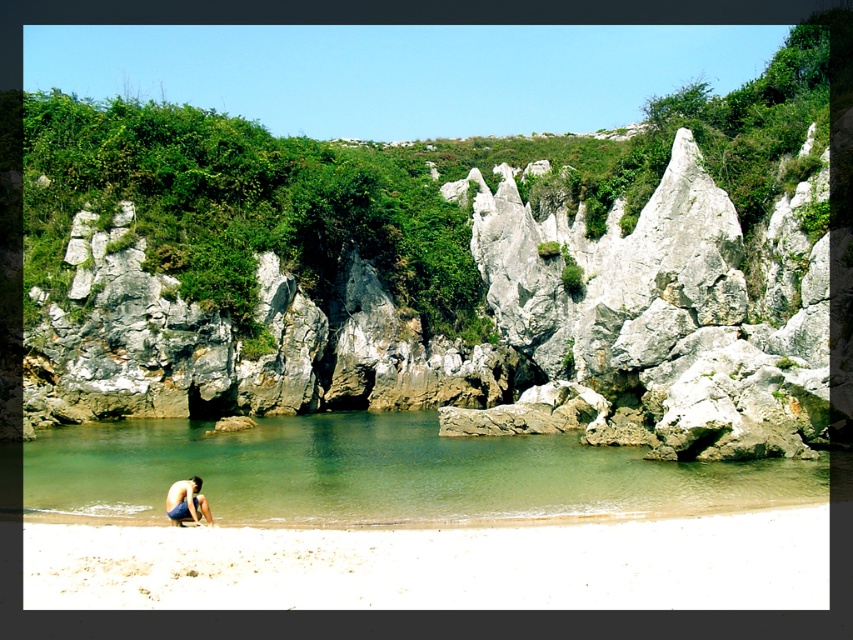
Question: Estimate the real-world distances between objects in this image. Which object is farther from the clear water at beach center?

Choices:
 (A) white sandy beach at lower center
 (B) blue denim shorts at lower left

Answer: (A)

Question: Is clear water at beach center below blue denim shorts at lower left?

Choices:
 (A) yes
 (B) no

Answer: (A)

Question: Which object appears closest to the camera in this image?

Choices:
 (A) white sandy beach at lower center
 (B) clear water at beach center

Answer: (A)

Question: Which object is closer to the camera taking this photo?

Choices:
 (A) blue denim shorts at lower left
 (B) white sandy beach at lower center

Answer: (B)

Question: Where is white sandy beach at lower center located in relation to clear water at beach center in the image?

Choices:
 (A) left
 (B) right

Answer: (B)

Question: Is white sandy beach at lower center below clear water at beach center?

Choices:
 (A) yes
 (B) no

Answer: (B)